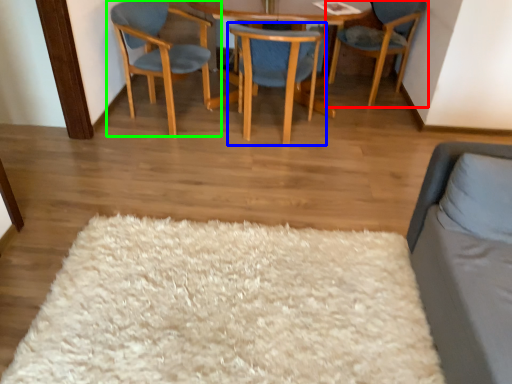
Question: Which object is positioned farthest from chair (highlighted by a red box)? Select from chair (highlighted by a blue box) and chair (highlighted by a green box).

Choices:
 (A) chair
 (B) chair

Answer: (B)